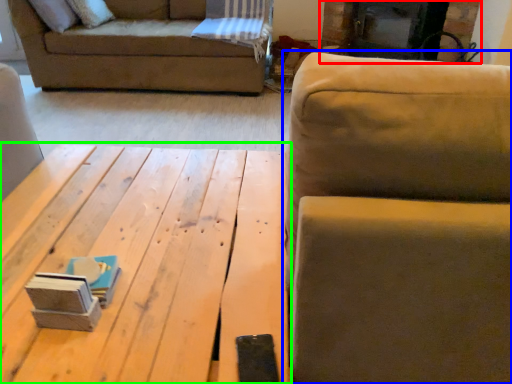
Question: Which object is positioned farthest from fireplace (highlighted by a red box)? Select from studio couch (highlighted by a blue box) and table (highlighted by a green box).

Choices:
 (A) studio couch
 (B) table

Answer: (A)